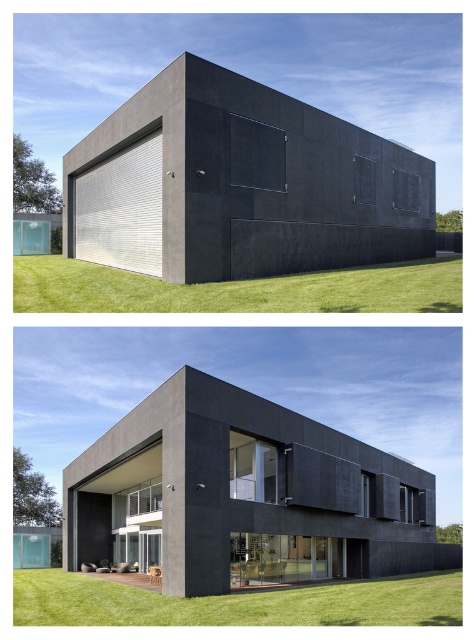
Is matte black wall at center thinner than matte black house at center?

Correct, matte black wall at center's width is less than matte black house at center's.

Can you confirm if matte black wall at center is smaller than matte black house at center?

Yes.

Who is more distant from viewer, (117, 129) or (306, 429)?

Point (117, 129)

Where is `matte black wall at center`? This screenshot has height=640, width=475. matte black wall at center is located at coordinates (239, 184).